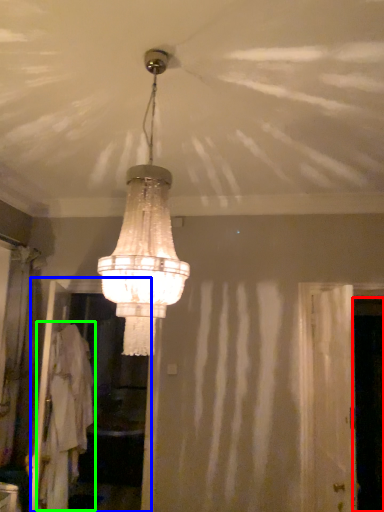
Question: Estimate the real-world distances between objects in this image. Which object is closer to screen door (highlighted by a red box), screen door (highlighted by a blue box) or robe (highlighted by a green box)?

Choices:
 (A) screen door
 (B) robe

Answer: (B)